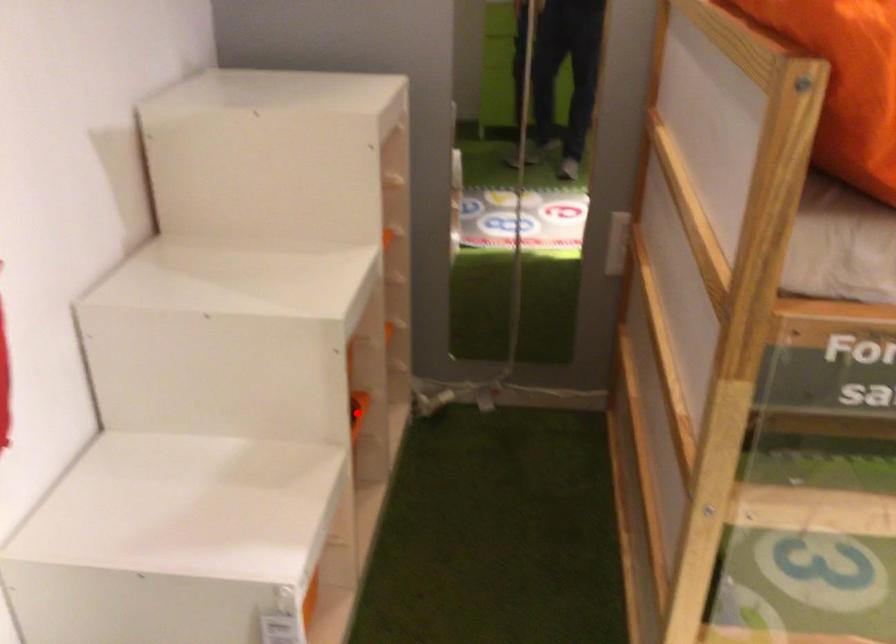
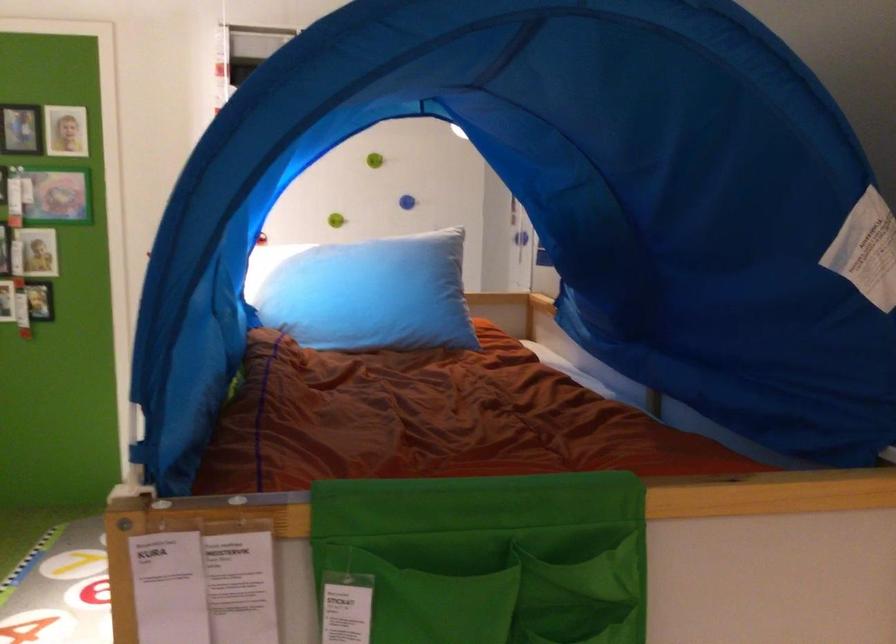
Question: I am providing you with two images of the same scene from different viewpoints. A red point is marked on the first image. Is the red point's position out of view in image 2?

Choices:
 (A) Yes
 (B) No

Answer: (A)